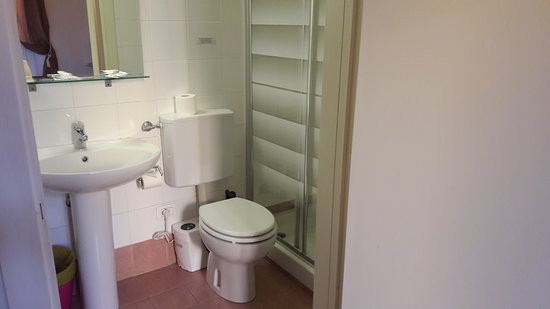
The width and height of the screenshot is (550, 309). In order to click on mirror in this screenshot , I will do `click(41, 48)`.